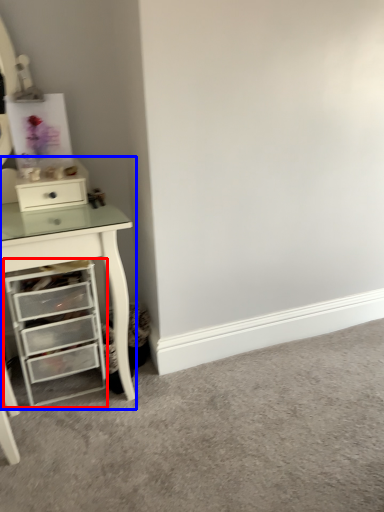
Question: Which of the following is the closest to the observer, chest of drawers (highlighted by a red box) or computer desk (highlighted by a blue box)?

Choices:
 (A) chest of drawers
 (B) computer desk

Answer: (B)